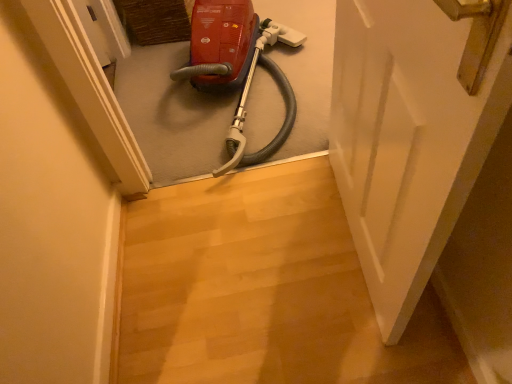
Question: In terms of height, does matte red vacuum cleaner at center look taller or shorter compared to white matte door at center?

Choices:
 (A) tall
 (B) short

Answer: (B)

Question: Does point pos(203,71) appear closer or farther from the camera than point pos(417,195)?

Choices:
 (A) closer
 (B) farther

Answer: (B)

Question: Considering the positions of matte red vacuum cleaner at center and white matte door at center in the image, is matte red vacuum cleaner at center bigger or smaller than white matte door at center?

Choices:
 (A) small
 (B) big

Answer: (B)

Question: From their relative heights in the image, would you say white matte door at center is taller or shorter than matte red vacuum cleaner at center?

Choices:
 (A) tall
 (B) short

Answer: (A)

Question: Is white matte door at center inside the boundaries of matte red vacuum cleaner at center, or outside?

Choices:
 (A) inside
 (B) outside

Answer: (B)

Question: From a real-world perspective, is white matte door at center positioned above or below matte red vacuum cleaner at center?

Choices:
 (A) above
 (B) below

Answer: (A)

Question: From the image's perspective, is white matte door at center above or below matte red vacuum cleaner at center?

Choices:
 (A) below
 (B) above

Answer: (A)